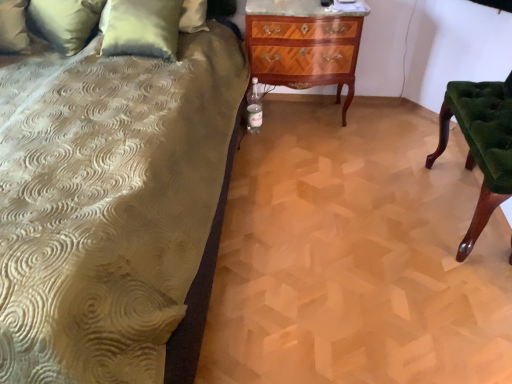
Question: From the image's perspective, is velvet green pillow at upper left, which is the 1th pillow from right to left, above green textured pillow at upper left, which is the 2th pillow in right-to-left order?

Choices:
 (A) no
 (B) yes

Answer: (A)

Question: Is velvet green pillow at upper left, marked as the 2th pillow in a left-to-right arrangement, further to the viewer compared to green textured pillow at upper left, which is the 2th pillow in right-to-left order?

Choices:
 (A) yes
 (B) no

Answer: (B)

Question: Is the position of velvet green pillow at upper left, which is the 1th pillow from right to left, less distant than that of green textured pillow at upper left, the 1th pillow viewed from the left?

Choices:
 (A) yes
 (B) no

Answer: (A)

Question: Is velvet green pillow at upper left, which is the 1th pillow from right to left, positioned beyond the bounds of green textured pillow at upper left, which is the 2th pillow in right-to-left order?

Choices:
 (A) no
 (B) yes

Answer: (B)

Question: Does velvet green pillow at upper left, marked as the 2th pillow in a left-to-right arrangement, have a lesser height compared to green textured pillow at upper left, which is the 2th pillow in right-to-left order?

Choices:
 (A) yes
 (B) no

Answer: (A)

Question: From a real-world perspective, is velvet green pillow at upper left, which is the 1th pillow from right to left, located beneath green textured pillow at upper left, which is the 2th pillow in right-to-left order?

Choices:
 (A) no
 (B) yes

Answer: (A)

Question: Is the depth of green textured pillow at upper left, the 1th pillow viewed from the left, greater than that of green velvet chair at right?

Choices:
 (A) yes
 (B) no

Answer: (A)

Question: From the image's perspective, is green textured pillow at upper left, which is the 2th pillow in right-to-left order, above green velvet chair at right?

Choices:
 (A) yes
 (B) no

Answer: (A)

Question: From the image's perspective, is green textured pillow at upper left, the 1th pillow viewed from the left, located beneath green velvet chair at right?

Choices:
 (A) yes
 (B) no

Answer: (B)

Question: Does green textured pillow at upper left, which is the 2th pillow in right-to-left order, have a smaller size compared to green velvet chair at right?

Choices:
 (A) no
 (B) yes

Answer: (A)

Question: Does green textured pillow at upper left, the 1th pillow viewed from the left, have a greater height compared to green velvet chair at right?

Choices:
 (A) no
 (B) yes

Answer: (B)

Question: Can you confirm if green textured pillow at upper left, which is the 2th pillow in right-to-left order, is bigger than green velvet chair at right?

Choices:
 (A) yes
 (B) no

Answer: (A)

Question: Is mahogany wood chest of drawers at center oriented towards green velvet chair at right?

Choices:
 (A) yes
 (B) no

Answer: (B)